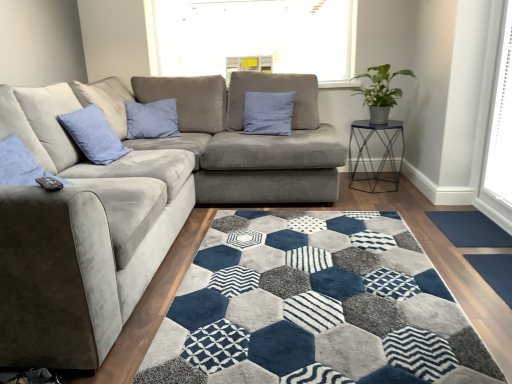
Question: From the image's perspective, does blue velvet pillow at upper left, positioned as the first pillow in left-to-right order, appear higher than dark blue textured mat at lower right, acting as the 2th doormat starting from the bottom?

Choices:
 (A) yes
 (B) no

Answer: (A)

Question: Does blue velvet pillow at upper left, the 1th pillow when ordered from front to back, lie behind dark blue textured mat at lower right, the 1th doormat from the back?

Choices:
 (A) yes
 (B) no

Answer: (A)

Question: Is dark blue textured mat at lower right, the 1th doormat from the back, at the back of blue velvet pillow at upper left, the 2th pillow when ordered from right to left?

Choices:
 (A) no
 (B) yes

Answer: (A)

Question: Is there a large distance between blue velvet pillow at upper left, the 2th pillow from the back, and dark blue textured mat at lower right, which appears as the first doormat when viewed from the top?

Choices:
 (A) no
 (B) yes

Answer: (B)

Question: From a real-world perspective, does blue velvet pillow at upper left, positioned as the first pillow in left-to-right order, stand above dark blue textured mat at lower right, the 1th doormat from the back?

Choices:
 (A) yes
 (B) no

Answer: (A)

Question: Is blue velvet pillow at upper left, the 2th pillow when ordered from right to left, wider than dark blue textured mat at lower right, which appears as the first doormat when viewed from the top?

Choices:
 (A) yes
 (B) no

Answer: (B)

Question: Can you confirm if blue velvet pillow at upper left, the 2th pillow when ordered from right to left, is positioned to the right of green matte plant at upper right?

Choices:
 (A) no
 (B) yes

Answer: (A)

Question: Is blue velvet pillow at upper left, the 1th pillow when ordered from front to back, positioned far away from green matte plant at upper right?

Choices:
 (A) yes
 (B) no

Answer: (A)

Question: From the image's perspective, does blue velvet pillow at upper left, the 1th pillow when ordered from front to back, appear lower than green matte plant at upper right?

Choices:
 (A) no
 (B) yes

Answer: (B)

Question: Is blue velvet pillow at upper left, positioned as the first pillow in left-to-right order, to the left of green matte plant at upper right from the viewer's perspective?

Choices:
 (A) no
 (B) yes

Answer: (B)

Question: Would you say blue velvet pillow at upper left, the 1th pillow when ordered from front to back, is outside green matte plant at upper right?

Choices:
 (A) no
 (B) yes

Answer: (B)

Question: Is blue velvet pillow at upper left, the 1th pillow when ordered from front to back, oriented away from green matte plant at upper right?

Choices:
 (A) yes
 (B) no

Answer: (B)

Question: Is green matte plant at upper right in front of metallic hexagonal table at right?

Choices:
 (A) no
 (B) yes

Answer: (B)